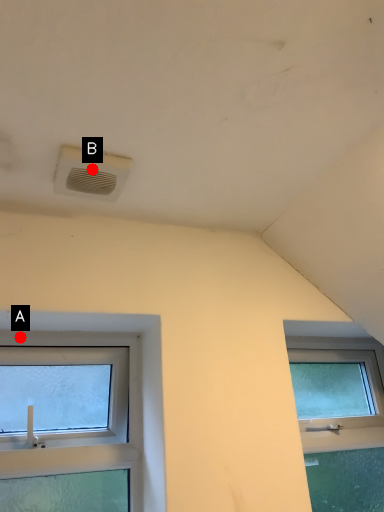
Question: Two points are circled on the image, labeled by A and B beside each circle. Among these points, which one is nearest to the camera?

Choices:
 (A) A is closer
 (B) B is closer

Answer: (B)